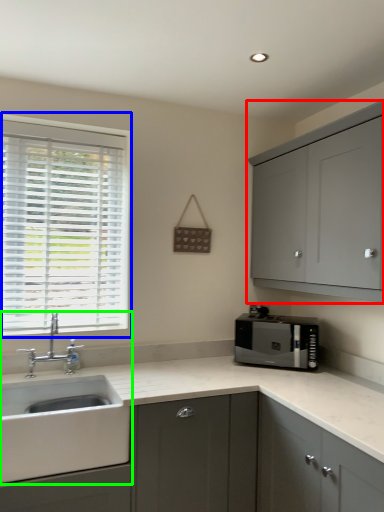
Question: Estimate the real-world distances between objects in this image. Which object is farther from cabinetry (highlighted by a red box), window (highlighted by a blue box) or sink (highlighted by a green box)?

Choices:
 (A) window
 (B) sink

Answer: (B)